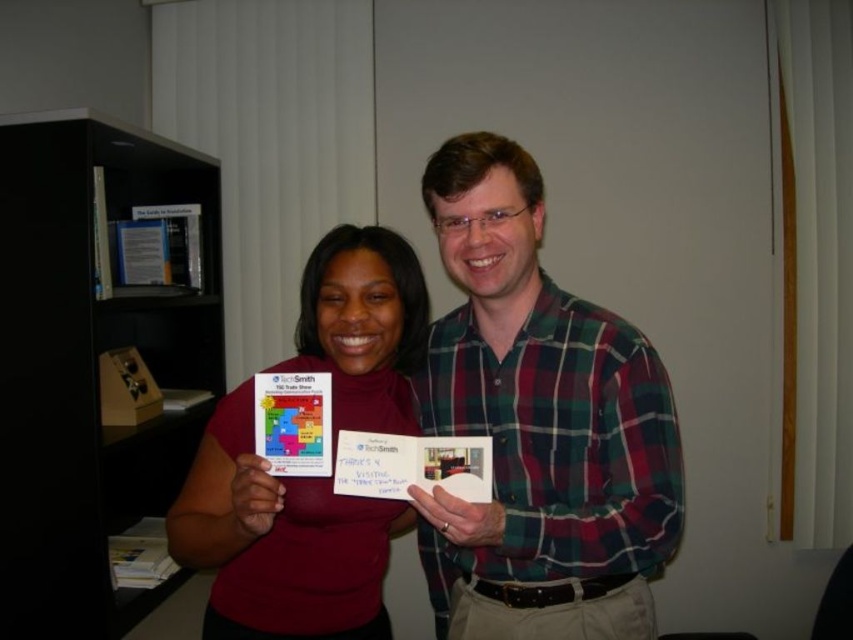
Can you confirm if plaid shirt at center is shorter than white paper at center?

Incorrect, plaid shirt at center's height does not fall short of white paper at center's.

How far apart are plaid shirt at center and white paper at center?

They are 8.74 inches apart.

Measure the distance between plaid shirt at center and camera.

plaid shirt at center is 37.88 inches from camera.

You are a GUI agent. You are given a task and a screenshot of the screen. Output one action in this format:
    pyautogui.click(x=<x>, y=<y>)
    Task: Click on the plaid shirt at center
    The width and height of the screenshot is (853, 640).
    Given the screenshot: What is the action you would take?
    pyautogui.click(x=538, y=426)

Does matte red shirt at center have a greater width compared to white paper at center?

Indeed, matte red shirt at center has a greater width compared to white paper at center.

Image resolution: width=853 pixels, height=640 pixels. What do you see at coordinates (279, 541) in the screenshot?
I see `matte red shirt at center` at bounding box center [279, 541].

Which is in front, point (293, 536) or point (390, 499)?

Point (390, 499)

At what (x,y) coordinates should I click in order to perform the action: click on matte red shirt at center. Please return your answer as a coordinate pair (x, y). This screenshot has height=640, width=853. Looking at the image, I should click on (279, 541).

Image resolution: width=853 pixels, height=640 pixels. Describe the element at coordinates (412, 465) in the screenshot. I see `white paper at center` at that location.

Who is taller, white paper at center or matte plastic card at center?

With more height is matte plastic card at center.

Find the location of `white paper at center`. white paper at center is located at coordinates (412, 465).

At what (x,y) coordinates should I click in order to perform the action: click on white paper at center. Please return your answer as a coordinate pair (x, y). The image size is (853, 640). Looking at the image, I should click on pos(412,465).